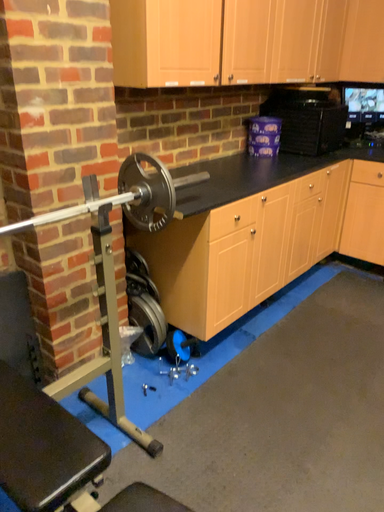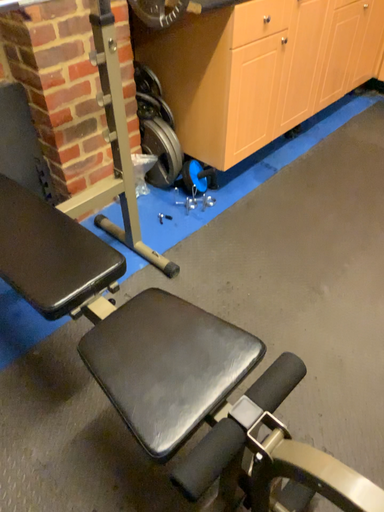
Question: Which way did the camera rotate in the video?

Choices:
 (A) rotated upward
 (B) rotated downward

Answer: (B)